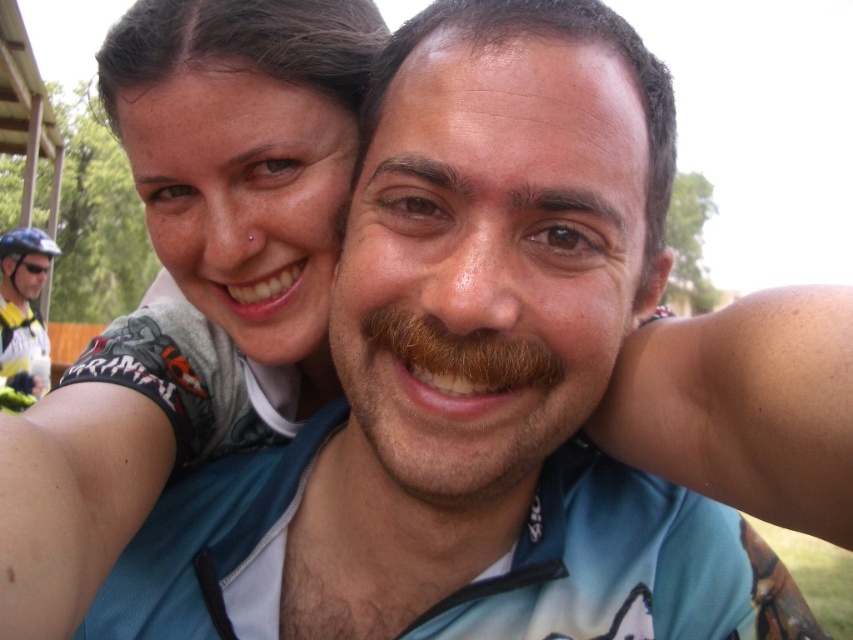
Question: Which point is farther from the camera taking this photo?

Choices:
 (A) (4, 355)
 (B) (33, 237)
 (C) (91, 394)
 (D) (485, 320)

Answer: (B)

Question: Which point appears closest to the camera in this image?

Choices:
 (A) (410, 337)
 (B) (155, 168)
 (C) (19, 401)

Answer: (A)

Question: Where is brown fuzzy mustache at center located in relation to blue matte bicycle helmet at upper left in the image?

Choices:
 (A) left
 (B) right

Answer: (B)

Question: Does brown fuzzy mustache at center lie in front of shiny blue helmet at left?

Choices:
 (A) no
 (B) yes

Answer: (B)

Question: Which object appears farthest from the camera in this image?

Choices:
 (A) shiny blue helmet at left
 (B) brown fuzzy mustache at center
 (C) blue matte bicycle helmet at upper left
 (D) matte skin at center

Answer: (C)

Question: Considering the relative positions of brown fuzzy mustache at center and blue matte bicycle helmet at upper left in the image provided, where is brown fuzzy mustache at center located with respect to blue matte bicycle helmet at upper left?

Choices:
 (A) above
 (B) below

Answer: (B)